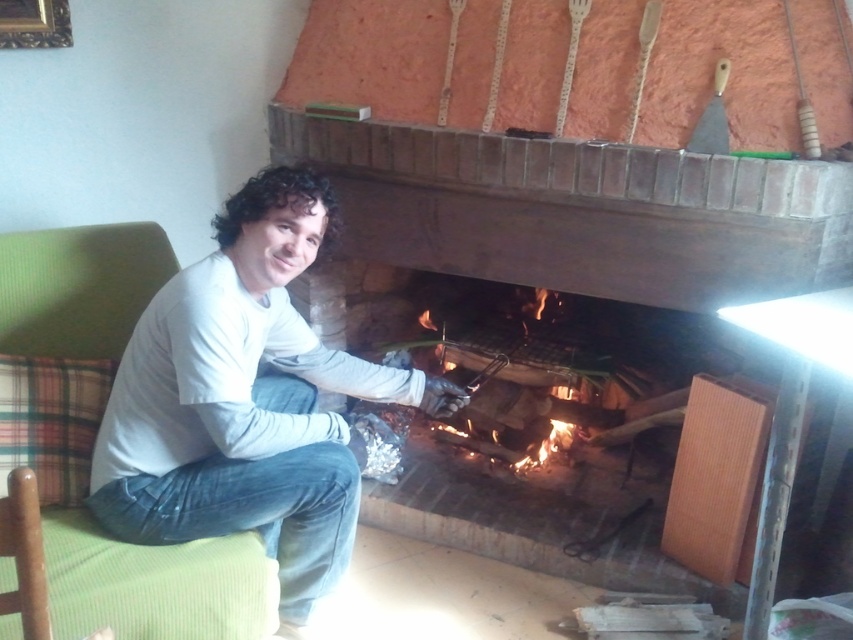
What do you see at coordinates (245, 401) in the screenshot?
I see `white matte shirt at center` at bounding box center [245, 401].

Which is above, white matte shirt at center or green fabric armchair at left?

white matte shirt at center is higher up.

Locate an element on the screen. This screenshot has width=853, height=640. white matte shirt at center is located at coordinates (245, 401).